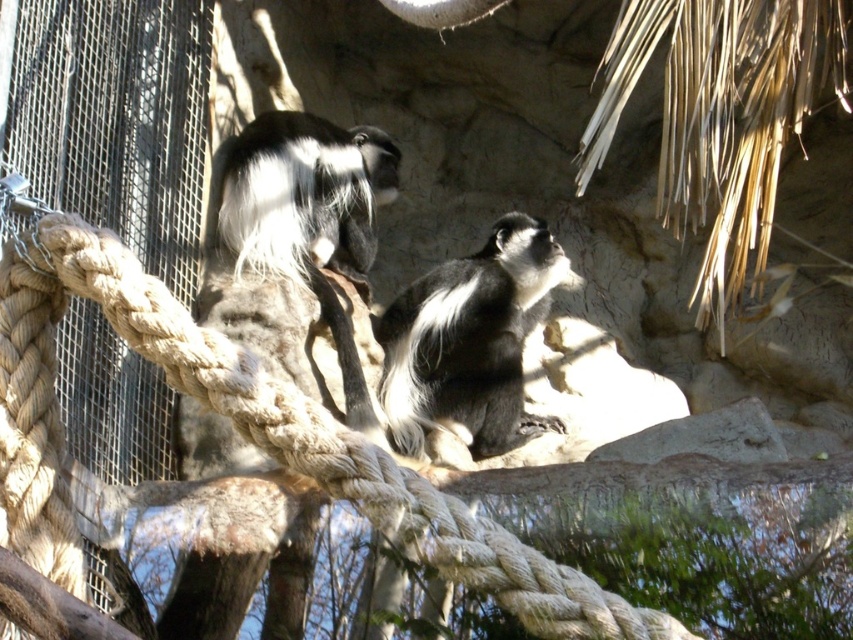
Question: Is black and white fur monkey at center wider than black and white fur monkey at upper center?

Choices:
 (A) yes
 (B) no

Answer: (A)

Question: Which object appears farthest from the camera in this image?

Choices:
 (A) black and white fur monkey at upper center
 (B) black and white fur monkey at center

Answer: (A)

Question: Which object appears farthest from the camera in this image?

Choices:
 (A) black and white fur monkey at upper center
 (B) black and white fur monkey at center

Answer: (A)

Question: From the image, what is the correct spatial relationship of black and white fur monkey at center in relation to black and white fur monkey at upper center?

Choices:
 (A) left
 (B) right

Answer: (B)

Question: Which point is closer to the camera?

Choices:
 (A) (374, 179)
 (B) (508, 448)

Answer: (B)

Question: Is black and white fur monkey at center below black and white fur monkey at upper center?

Choices:
 (A) no
 (B) yes

Answer: (B)